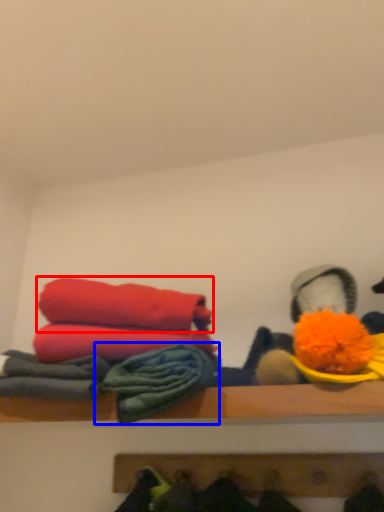
Question: Which of the following is the closest to the observer, towel (highlighted by a red box) or material (highlighted by a blue box)?

Choices:
 (A) towel
 (B) material

Answer: (B)